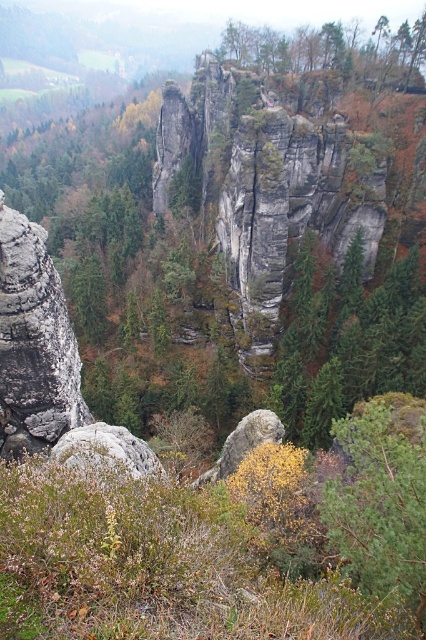
Can you confirm if green matte tree at center is positioned to the right of green textured tree at lower right?

Correct, you'll find green matte tree at center to the right of green textured tree at lower right.

Between point (327, 433) and point (360, 522), which one is positioned in front?

Point (360, 522) is in front.

Who is more distant from viewer, (359, 237) or (374, 468)?

Point (359, 237)

Where is `green matte tree at center`? The width and height of the screenshot is (426, 640). green matte tree at center is located at coordinates (348, 342).

Describe the element at coordinates (34, 342) in the screenshot. The image size is (426, 640). I see `rough gray rock at left` at that location.

Which is in front, point (29, 243) or point (267, 42)?

Point (29, 243) is in front.

What do you see at coordinates (34, 342) in the screenshot? This screenshot has width=426, height=640. I see `rough gray rock at left` at bounding box center [34, 342].

The width and height of the screenshot is (426, 640). Find the location of `rough gray rock at left`. rough gray rock at left is located at coordinates (34, 342).

Between green textured tree at lower right and rough gray rock at left, which one has more height?

rough gray rock at left

Which is behind, point (388, 461) or point (3, 394)?

The point (3, 394) is behind.

Measure the distance between green textured tree at lower right and camera.

The distance of green textured tree at lower right from camera is 28.07 meters.

Identify the location of green textured tree at lower right. Image resolution: width=426 pixels, height=640 pixels. (379, 506).